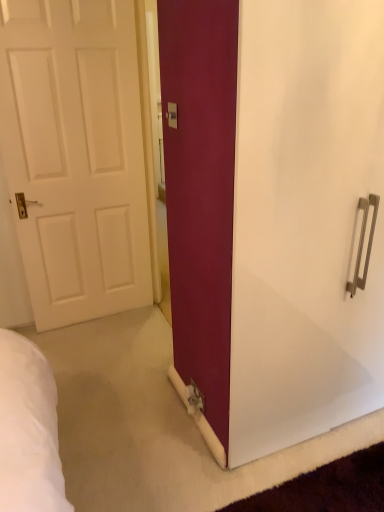
Question: Is white matte door at left facing towards matte white screen door at center?

Choices:
 (A) yes
 (B) no

Answer: (B)

Question: Does white matte door at left appear on the right side of matte white screen door at center?

Choices:
 (A) no
 (B) yes

Answer: (A)

Question: From a real-world perspective, is white matte door at left positioned over matte white screen door at center based on gravity?

Choices:
 (A) yes
 (B) no

Answer: (A)

Question: Is white matte door at left outside of matte white screen door at center?

Choices:
 (A) no
 (B) yes

Answer: (B)

Question: Is the position of white matte door at left less distant than that of matte white screen door at center?

Choices:
 (A) yes
 (B) no

Answer: (B)

Question: Is point (340, 53) closer or farther from the camera than point (173, 126)?

Choices:
 (A) farther
 (B) closer

Answer: (B)

Question: Looking at the image, does matte white screen door at center seem bigger or smaller compared to matte white electric outlet at center?

Choices:
 (A) big
 (B) small

Answer: (A)

Question: From a real-world perspective, relative to matte white electric outlet at center, is matte white screen door at center vertically above or below?

Choices:
 (A) above
 (B) below

Answer: (B)

Question: Based on their positions, is matte white screen door at center located to the left or right of matte white electric outlet at center?

Choices:
 (A) left
 (B) right

Answer: (B)

Question: From the image's perspective, relative to matte white electric outlet at center, is white matte door at left above or below?

Choices:
 (A) above
 (B) below

Answer: (B)

Question: In terms of width, does white matte door at left look wider or thinner when compared to matte white electric outlet at center?

Choices:
 (A) wide
 (B) thin

Answer: (A)

Question: In the image, is white matte door at left positioned in front of or behind matte white electric outlet at center?

Choices:
 (A) front
 (B) behind

Answer: (B)

Question: In terms of height, does white matte door at left look taller or shorter compared to matte white electric outlet at center?

Choices:
 (A) short
 (B) tall

Answer: (B)

Question: From the image's perspective, is white matte door at left located above or below matte white screen door at center?

Choices:
 (A) below
 (B) above

Answer: (B)

Question: Choose the correct answer: Is white matte door at left inside matte white screen door at center or outside it?

Choices:
 (A) outside
 (B) inside

Answer: (A)